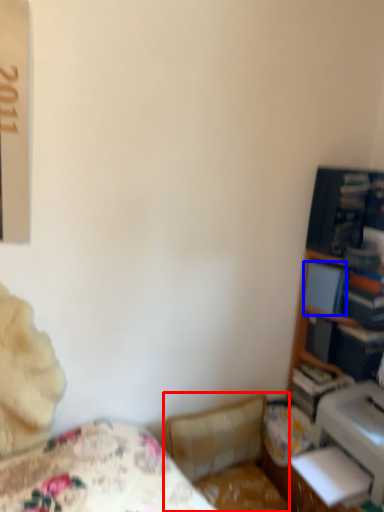
Question: Among these objects, which one is farthest to the camera, swivel chair (highlighted by a red box) or paperback book (highlighted by a blue box)?

Choices:
 (A) swivel chair
 (B) paperback book

Answer: (B)